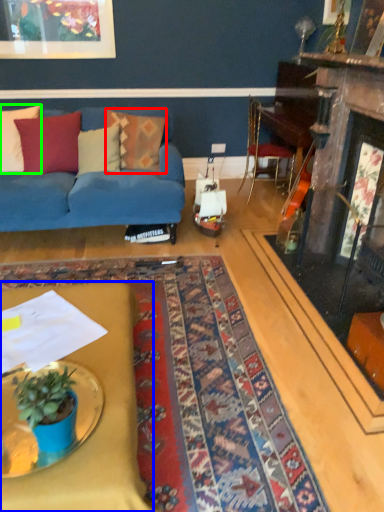
Question: Based on their relative distances, which object is nearer to pillow (highlighted by a red box)? Choose from desk (highlighted by a blue box) and pillow (highlighted by a green box).

Choices:
 (A) desk
 (B) pillow

Answer: (B)